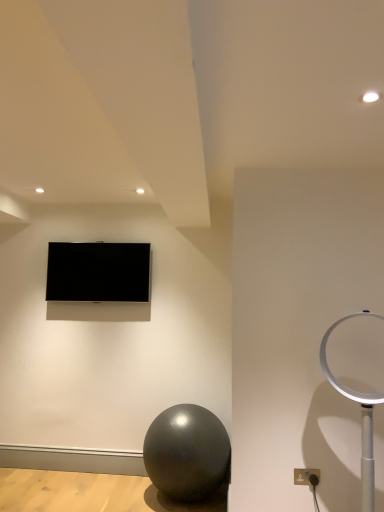
Question: From the image's perspective, is shiny metallic ball at lower center positioned above or below white plastic table lamp at right?

Choices:
 (A) below
 (B) above

Answer: (A)

Question: Is point (195, 406) positioned closer to the camera than point (370, 458)?

Choices:
 (A) farther
 (B) closer

Answer: (A)

Question: Estimate the real-world distances between objects in this image. Which object is closer to the white plastic table lamp at right?

Choices:
 (A) matte black tv at upper center
 (B) matte gray outlet at lower right
 (C) shiny metallic ball at lower center

Answer: (B)

Question: Which object is the farthest from the white plastic table lamp at right?

Choices:
 (A) matte gray outlet at lower right
 (B) shiny metallic ball at lower center
 (C) matte black tv at upper center

Answer: (C)